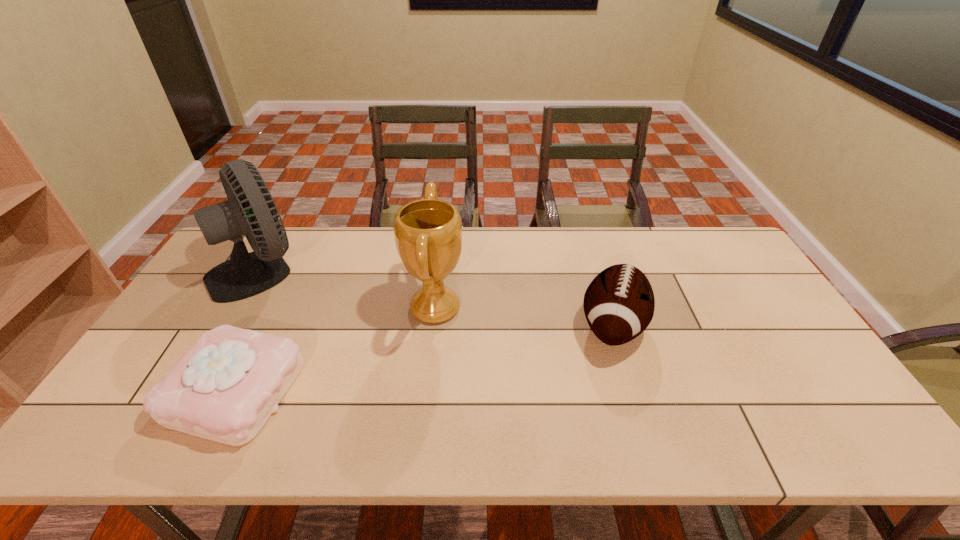
In order to click on vacant space that satisfies the following two spatial constraints: 1. on the front of the football (American) with the decoration; 2. on the right side of the second object from right to left in this screenshot , I will do `click(433, 326)`.

Where is `vacant area in the image that satisfies the following two spatial constraints: 1. in front of the second shortest object to direct airflow; 2. on the left side of the fan`? This screenshot has width=960, height=540. vacant area in the image that satisfies the following two spatial constraints: 1. in front of the second shortest object to direct airflow; 2. on the left side of the fan is located at coordinates [x=227, y=326].

Find the location of a particular element. The width and height of the screenshot is (960, 540). vacant space that satisfies the following two spatial constraints: 1. on the back side of the football (American); 2. on the front of the third object from left to right with the decoration is located at coordinates [x=607, y=308].